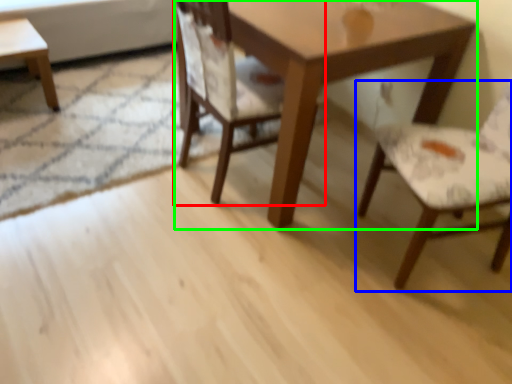
Question: Which is farther away from chair (highlighted by a red box)? chair (highlighted by a blue box) or table (highlighted by a green box)?

Choices:
 (A) chair
 (B) table

Answer: (A)